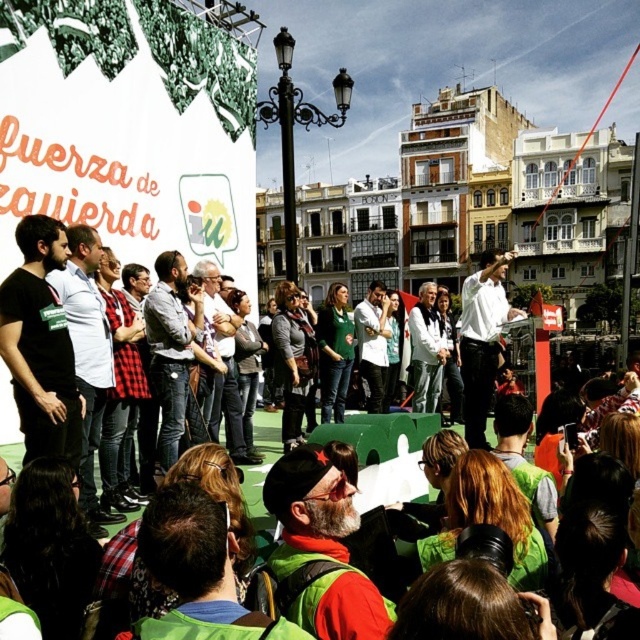
Question: Does matte black shirt at left lie behind light gray shirt at center?

Choices:
 (A) yes
 (B) no

Answer: (B)

Question: Estimate the real-world distances between objects in this image. Which object is farther from the black shirt at center?

Choices:
 (A) white glossy shirt at center
 (B) light gray shirt at center
 (C) red plaid shirt at center

Answer: (A)

Question: Can you confirm if green fabric vest at center is positioned to the left of white shirt at center?

Choices:
 (A) no
 (B) yes

Answer: (B)

Question: Which point is closer to the camera?

Choices:
 (A) (320, 500)
 (B) (141, 308)

Answer: (A)

Question: Can you confirm if green fabric vest at center is positioned to the right of matte black shirt at left?

Choices:
 (A) yes
 (B) no

Answer: (A)

Question: Among these objects, which one is nearest to the camera?

Choices:
 (A) black shirt at center
 (B) matte black shirt at left
 (C) red plaid shirt at center

Answer: (A)